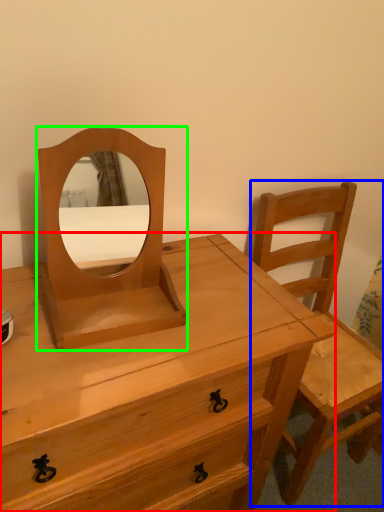
Question: Which object is positioned farthest from chest of drawers (highlighted by a red box)? Select from chair (highlighted by a blue box) and mirror (highlighted by a green box).

Choices:
 (A) chair
 (B) mirror

Answer: (A)